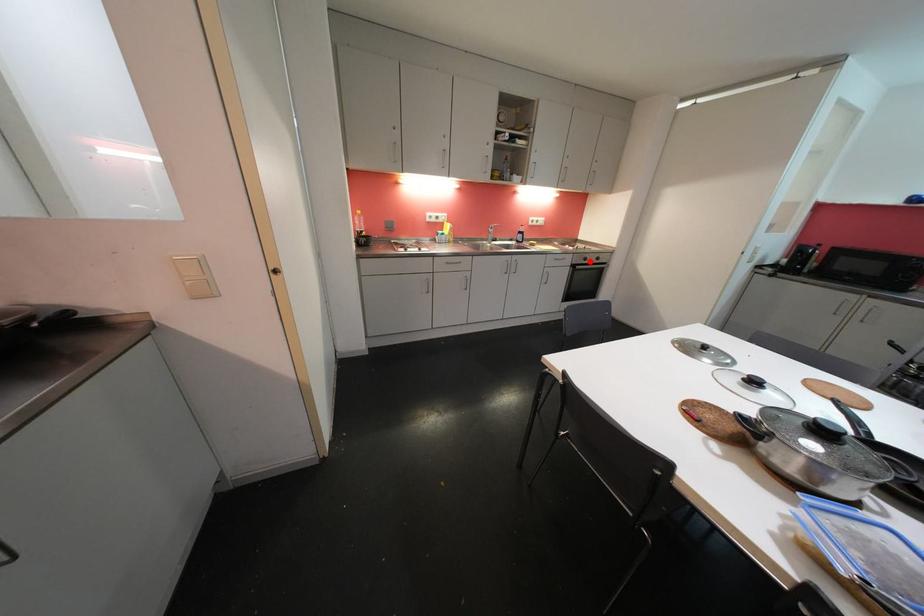
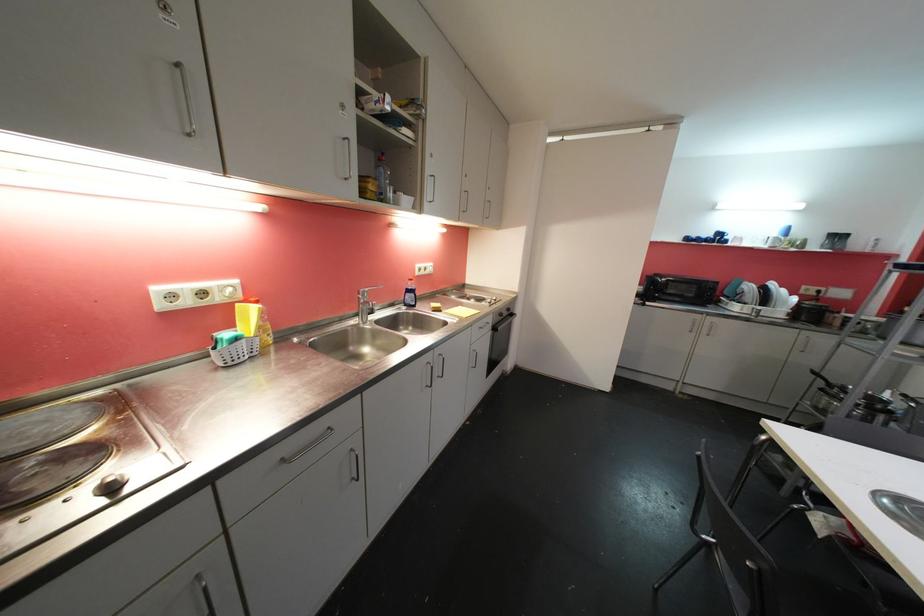
In the second image, find the point that corresponds to the highlighted location in the first image.

(505, 317)